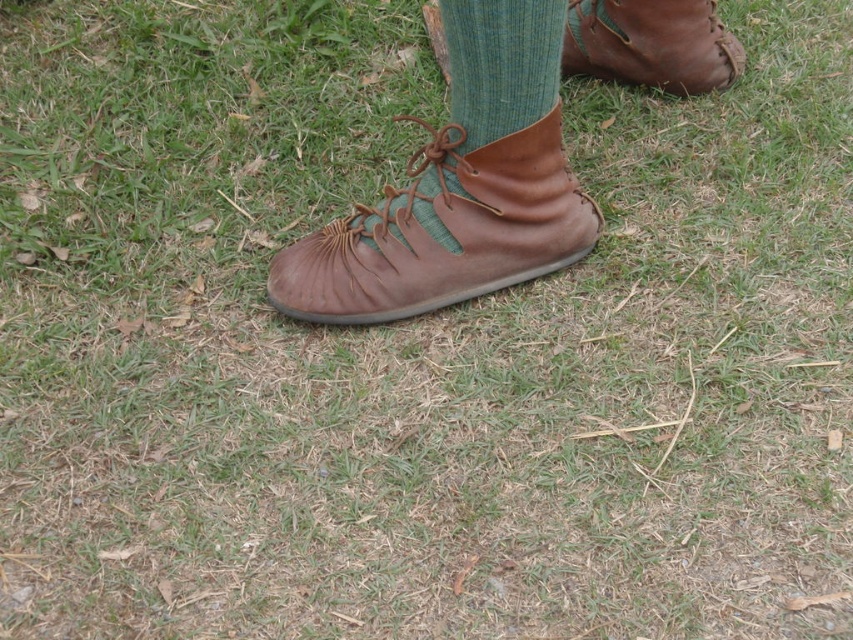
Looking at this image, you are trying to put on your brown leather boot at center and green knitted sock at center. Which item should you put on first according to their sizes?

Since the brown leather boot at center is larger than the green knitted sock at center, you should put on the green knitted sock at center first before the boot.

You are a photographer trying to capture the green knitted sock at center in the frame. The camera is positioned at point 0.0, 0.0. Where should you move the camera to focus on the sock?

Move the camera to the right and upwards to point (502, 64) to focus on the green knitted sock at center.

You are trying to find your left shoe in the image. You see two brown leather boot at center and brown leather boot at upper right. Which one is more towards the center?

The brown leather boot at center is more towards the center.